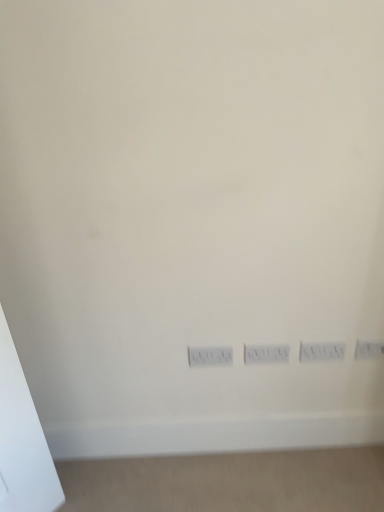
Question: From a real-world perspective, is white plastic switch at center positioned above or below white plastic electric outlet at center, the first electric outlet viewed from the left?

Choices:
 (A) above
 (B) below

Answer: (B)

Question: Is white plastic switch at center in front of or behind white plastic electric outlet at center, the first electric outlet viewed from the left, in the image?

Choices:
 (A) front
 (B) behind

Answer: (B)

Question: Estimate the real-world distances between objects in this image. Which object is farther from the white plastic electric outlet at lower right, marked as the 2th electric outlet in a left-to-right arrangement?

Choices:
 (A) white plastic power plugs and sockets at center
 (B) white plastic electric outlet at center, the 2th electric outlet from the right
 (C) white plastic switch at center

Answer: (A)

Question: Estimate the real-world distances between objects in this image. Which object is farther from the white plastic switch at center?

Choices:
 (A) white plastic electric outlet at lower right, marked as the 2th electric outlet in a left-to-right arrangement
 (B) white plastic electric outlet at center, the first electric outlet viewed from the left
 (C) white plastic power plugs and sockets at center

Answer: (A)